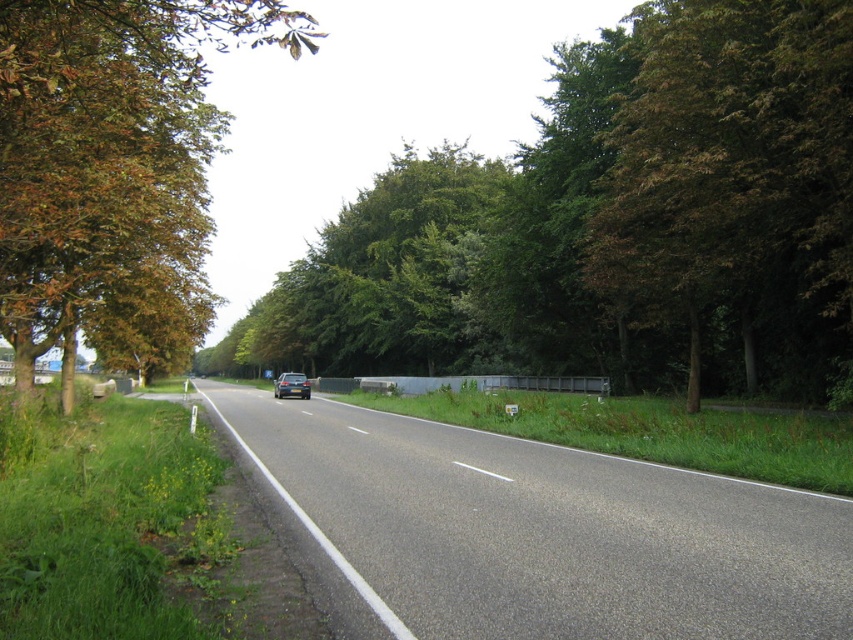
Question: Which object is positioned farthest from the brown leafy tree at left?

Choices:
 (A) green leafy tree at center
 (B) asphalt road at center
 (C) satin black car at center

Answer: (C)

Question: Which object is positioned closest to the satin black car at center?

Choices:
 (A) green leafy tree at center
 (B) brown leafy tree at left
 (C) asphalt road at center
 (D) green leafy tree at right

Answer: (A)

Question: Is the position of green leafy tree at center more distant than that of asphalt road at center?

Choices:
 (A) no
 (B) yes

Answer: (B)

Question: Which of the following is the closest to the observer?

Choices:
 (A) (381, 352)
 (B) (302, 385)
 (C) (836, 241)

Answer: (C)

Question: Where is green leafy tree at center located in relation to green leafy tree at right in the image?

Choices:
 (A) left
 (B) right

Answer: (A)

Question: Is green leafy tree at center smaller than satin black car at center?

Choices:
 (A) no
 (B) yes

Answer: (A)